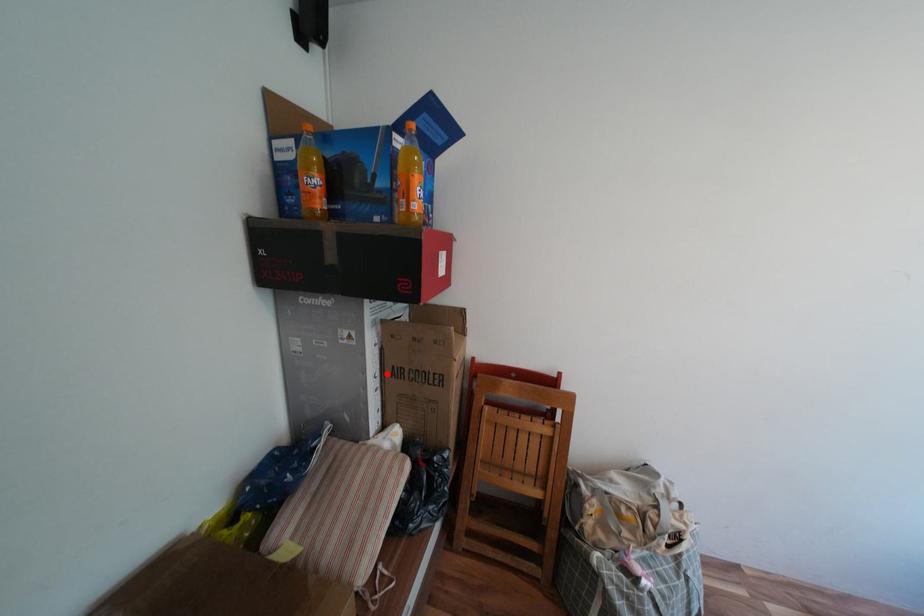
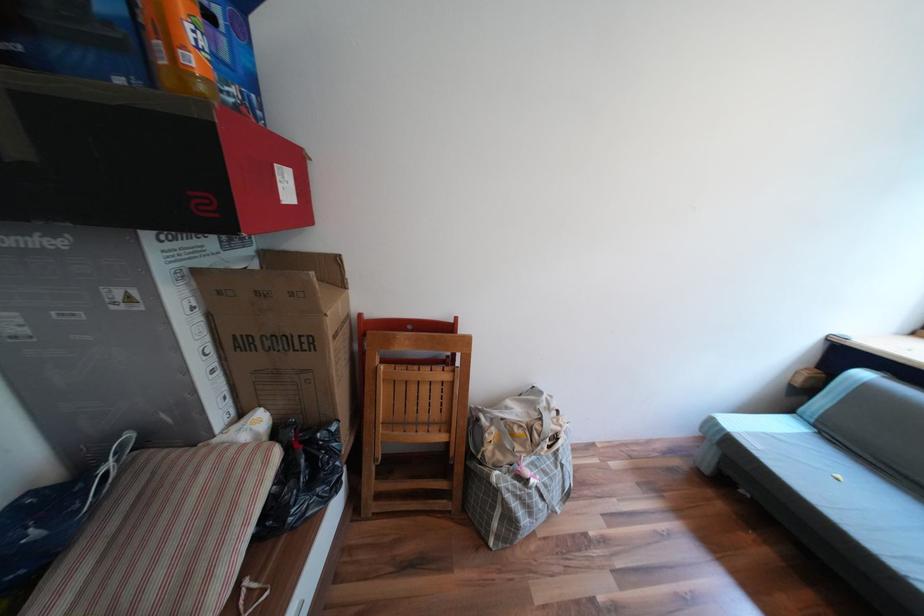
Where in the second image is the point corresponding to the highlighted location from the first image?

(219, 349)